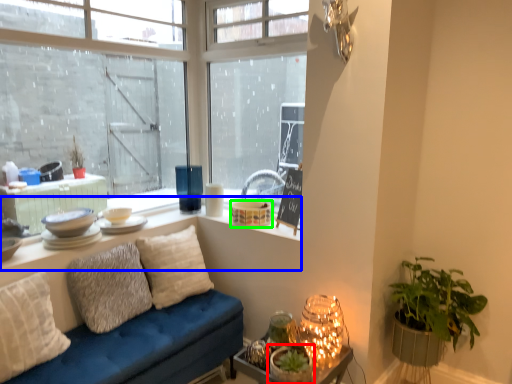
Question: Based on their relative distances, which object is farther from houseplant (highlighted by a red box)? Choose from window (highlighted by a blue box) and candle holder (highlighted by a green box).

Choices:
 (A) window
 (B) candle holder

Answer: (B)